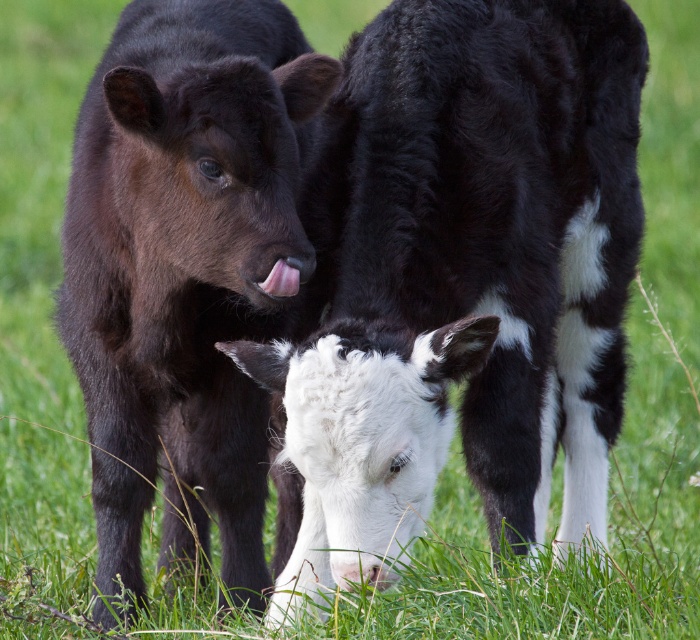
Question: Which object is closer to the camera taking this photo?

Choices:
 (A) pink smooth tongue at center
 (B) black matte calf at left

Answer: (B)

Question: Does black matte calf at left appear on the right side of pink smooth tongue at center?

Choices:
 (A) no
 (B) yes

Answer: (A)

Question: Is black matte calf at left positioned at the back of pink smooth tongue at center?

Choices:
 (A) yes
 (B) no

Answer: (B)

Question: In this image, where is black matte calf at left located relative to pink smooth tongue at center?

Choices:
 (A) above
 (B) below

Answer: (B)

Question: Which of the following is the closest to the observer?

Choices:
 (A) (294, 284)
 (B) (252, 460)

Answer: (A)